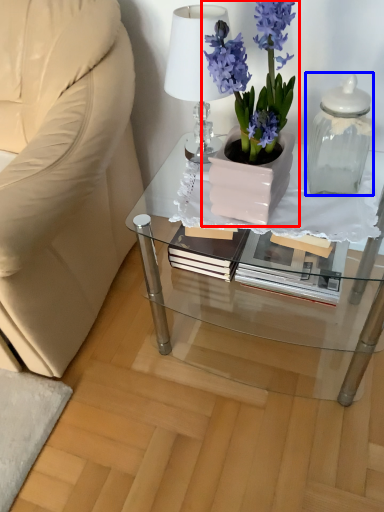
Question: Which of the following is the farthest to the observer, houseplant (highlighted by a red box) or bottle (highlighted by a blue box)?

Choices:
 (A) houseplant
 (B) bottle

Answer: (B)